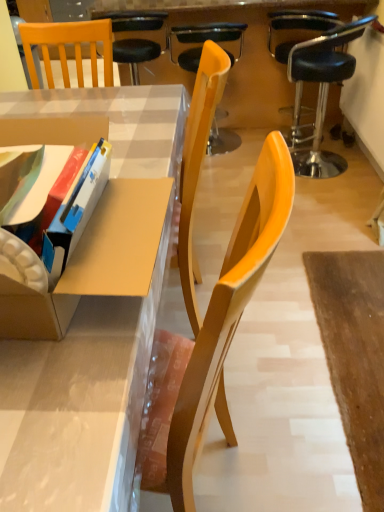
Locate an element on the screen. cardboard box at left is located at coordinates (95, 261).

What are the coordinates of `matte plastic desk at center` in the screenshot? It's located at (95, 318).

Describe the element at coordinates (95, 318) in the screenshot. The width and height of the screenshot is (384, 512). I see `matte plastic desk at center` at that location.

In order to face black leather stool at upper right, the 1th chair when ordered from right to left, should I rotate leftwards or rightwards?

You should look right and rotate roughly 16.976 degrees.

Locate an element on the screen. The height and width of the screenshot is (512, 384). wooden chair at center, which is the second chair in left-to-right order is located at coordinates (210, 35).

Find the location of a particular element. cardboard box at left is located at coordinates (95, 261).

Can you tell me how much matte plastic desk at center and black leather stool at upper right, the 1th chair when ordered from right to left, differ in facing direction?

The angle between the facing direction of matte plastic desk at center and the facing direction of black leather stool at upper right, the 1th chair when ordered from right to left, is 90 degrees.

Is matte plastic desk at center facing away from black leather stool at upper right, the third chair viewed from the left?

No, matte plastic desk at center's orientation is not away from black leather stool at upper right, the third chair viewed from the left.

Between matte plastic desk at center and black leather stool at upper right, the third chair viewed from the left, which one has less height?

With less height is matte plastic desk at center.

Between matte plastic desk at center and black leather stool at upper right, the third chair viewed from the left, which one has larger width?

With larger width is matte plastic desk at center.

At what (x,y) coordinates should I click in order to perform the action: click on the 2nd chair above when counting from the black leather stool at upper right, the third chair viewed from the left (from the image's perspective). Please return your answer as a coordinate pair (x, y). The width and height of the screenshot is (384, 512). Looking at the image, I should click on (135, 54).

Is black leather stool at upper right, the third chair viewed from the left, surrounded by wooden chair at upper left, the 3th chair when ordered from right to left?

That's incorrect, black leather stool at upper right, the third chair viewed from the left, is not inside wooden chair at upper left, the 3th chair when ordered from right to left.

Does wooden chair at upper left, the first chair viewed from the left, come in front of black leather stool at upper right, the third chair viewed from the left?

No, the depth of wooden chair at upper left, the first chair viewed from the left, is greater than that of black leather stool at upper right, the third chair viewed from the left.

Can you tell me how much cardboard box at left and wooden chair at upper left, the 3th chair when ordered from right to left, differ in facing direction?

88.1 degrees separate the facing orientations of cardboard box at left and wooden chair at upper left, the 3th chair when ordered from right to left.

Who is shorter, cardboard box at left or wooden chair at upper left, the first chair viewed from the left?

With less height is wooden chair at upper left, the first chair viewed from the left.

From the image's perspective, is cardboard box at left above or below wooden chair at upper left, the 3th chair when ordered from right to left?

cardboard box at left is below wooden chair at upper left, the 3th chair when ordered from right to left.

Which of these two, cardboard box at left or wooden chair at upper left, the first chair viewed from the left, is bigger?

With larger size is cardboard box at left.

Can you confirm if wooden chair at upper left, the 3th chair when ordered from right to left, is bigger than cardboard box at left?

No, wooden chair at upper left, the 3th chair when ordered from right to left, is not bigger than cardboard box at left.

Where is `cardboard box on the right of wooden chair at upper left, the first chair viewed from the left`? cardboard box on the right of wooden chair at upper left, the first chair viewed from the left is located at coordinates (95, 261).

Which object is further away from the camera, wooden chair at upper left, the first chair viewed from the left, or cardboard box at left?

Positioned behind is wooden chair at upper left, the first chair viewed from the left.

Between wooden chair at upper left, the first chair viewed from the left, and cardboard box at left, which one has larger width?

Wider between the two is cardboard box at left.

Based on the photo, could you tell me if wooden chair at upper left, the 3th chair when ordered from right to left, is turned towards matte plastic desk at center?

No, wooden chair at upper left, the 3th chair when ordered from right to left, is not facing towards matte plastic desk at center.

Which is in front, point (118, 41) or point (44, 457)?

The point (44, 457) is closer.

From the image's perspective, which is above, wooden chair at upper left, the first chair viewed from the left, or matte plastic desk at center?

wooden chair at upper left, the first chair viewed from the left, from the image's perspective.

How much distance is there between wooden chair at upper left, the 3th chair when ordered from right to left, and matte plastic desk at center?

wooden chair at upper left, the 3th chair when ordered from right to left, and matte plastic desk at center are 1.63 meters apart.

From a real-world perspective, is matte plastic desk at center beneath wooden chair at upper left, the 3th chair when ordered from right to left?

Yes, from a real-world perspective, matte plastic desk at center is under wooden chair at upper left, the 3th chair when ordered from right to left.

Can we say matte plastic desk at center lies outside wooden chair at upper left, the 3th chair when ordered from right to left?

Yes, matte plastic desk at center is located beyond the bounds of wooden chair at upper left, the 3th chair when ordered from right to left.

Is matte plastic desk at center in front of or behind wooden chair at upper left, the 3th chair when ordered from right to left, in the image?

matte plastic desk at center is positioned closer to the viewer than wooden chair at upper left, the 3th chair when ordered from right to left.

Is black leather stool at upper right, the third chair viewed from the left, taller or shorter than cardboard box at left?

Considering their sizes, black leather stool at upper right, the third chair viewed from the left, has less height than cardboard box at left.

Which is correct: black leather stool at upper right, the third chair viewed from the left, is inside cardboard box at left, or outside of it?

black leather stool at upper right, the third chair viewed from the left, lies outside cardboard box at left.

Identify the location of cardboard box above the black leather stool at upper right, the third chair viewed from the left (from a real-world perspective). (95, 261).

Can you tell me how much black leather stool at upper right, the third chair viewed from the left, and cardboard box at left differ in facing direction?

The angular difference between black leather stool at upper right, the third chair viewed from the left, and cardboard box at left is 89.4 degrees.

Identify the location of the 1st chair behind the matte plastic desk at center. The image size is (384, 512). (316, 80).

This screenshot has height=512, width=384. Find the location of `chair in front of the wooden chair at upper left, the first chair viewed from the left`. chair in front of the wooden chair at upper left, the first chair viewed from the left is located at coordinates (316, 80).

When comparing their distances from cardboard box at left, does wooden chair at upper left, the 3th chair when ordered from right to left, or black leather stool at upper right, the third chair viewed from the left, seem closer?

black leather stool at upper right, the third chair viewed from the left, is positioned closer to the anchor cardboard box at left.

When comparing their distances from wooden chair at center, the 2th chair positioned from the right, does matte plastic desk at center or wooden chair at upper left, the first chair viewed from the left, seem closer?

wooden chair at upper left, the first chair viewed from the left, is closer to wooden chair at center, the 2th chair positioned from the right.

Looking at this image, from the image, which object appears to be nearer to cardboard box at left, wooden chair at upper left, the first chair viewed from the left, or matte plastic desk at center?

The object closer to cardboard box at left is matte plastic desk at center.

From the image, which object appears to be nearer to matte plastic desk at center, wooden chair at center, the 2th chair positioned from the right, or cardboard box at left?

Based on the image, cardboard box at left appears to be nearer to matte plastic desk at center.

Considering their positions, is wooden chair at upper left, the first chair viewed from the left, positioned closer to matte plastic desk at center than wooden chair at center, the 2th chair positioned from the right?

wooden chair at upper left, the first chair viewed from the left, is closer to matte plastic desk at center.

Looking at the image, which one is located further to cardboard box at left, black leather stool at upper right, the third chair viewed from the left, or wooden chair at upper left, the first chair viewed from the left?

Based on the image, wooden chair at upper left, the first chair viewed from the left, appears to be further to cardboard box at left.

Based on their spatial positions, is wooden chair at upper left, the first chair viewed from the left, or matte plastic desk at center further from black leather stool at upper right, the third chair viewed from the left?

matte plastic desk at center lies further to black leather stool at upper right, the third chair viewed from the left, than the other object.

Estimate the real-world distances between objects in this image. Which object is further from cardboard box at left, black leather stool at upper right, the third chair viewed from the left, or matte plastic desk at center?

Based on the image, black leather stool at upper right, the third chair viewed from the left, appears to be further to cardboard box at left.

Locate an element on the screen. This screenshot has height=512, width=384. cardboard box located between matte plastic desk at center and black leather stool at upper right, the third chair viewed from the left, in the depth direction is located at coordinates (95, 261).

This screenshot has height=512, width=384. I want to click on chair between cardboard box at left and wooden chair at upper left, the 3th chair when ordered from right to left, from front to back, so click(316, 80).

At what (x,y) coordinates should I click in order to perform the action: click on chair between wooden chair at upper left, the first chair viewed from the left, and black leather stool at upper right, the third chair viewed from the left. Please return your answer as a coordinate pair (x, y). This screenshot has height=512, width=384. Looking at the image, I should click on (210, 35).

Locate an element on the screen. The width and height of the screenshot is (384, 512). chair between matte plastic desk at center and wooden chair at upper left, the first chair viewed from the left, in the front-back direction is located at coordinates (316, 80).